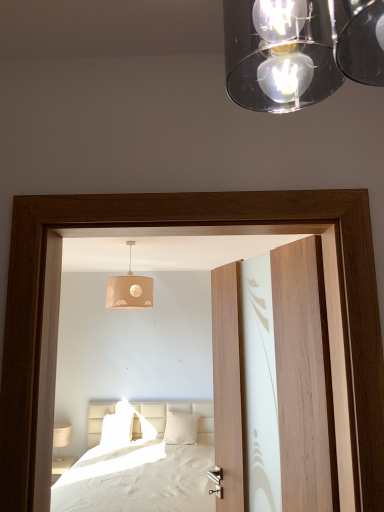
Question: Is beige fabric lampshade at center at the left side of wooden door at center?

Choices:
 (A) no
 (B) yes

Answer: (B)

Question: Is beige fabric lampshade at center located outside wooden door at center?

Choices:
 (A) no
 (B) yes

Answer: (B)

Question: Does beige fabric lampshade at center appear on the right side of wooden door at center?

Choices:
 (A) yes
 (B) no

Answer: (B)

Question: Is beige fabric lampshade at center aimed at wooden door at center?

Choices:
 (A) yes
 (B) no

Answer: (B)

Question: From a real-world perspective, is beige fabric lampshade at center located higher than wooden door at center?

Choices:
 (A) yes
 (B) no

Answer: (A)

Question: Does beige fabric lampshade at center lie behind wooden door at center?

Choices:
 (A) yes
 (B) no

Answer: (A)

Question: Does white fabric table lamp at lower left turn towards wooden door at center?

Choices:
 (A) yes
 (B) no

Answer: (B)

Question: Can you confirm if white fabric table lamp at lower left is wider than wooden door at center?

Choices:
 (A) yes
 (B) no

Answer: (A)

Question: From the image's perspective, is white fabric table lamp at lower left beneath wooden door at center?

Choices:
 (A) no
 (B) yes

Answer: (B)

Question: Can you confirm if white fabric table lamp at lower left is bigger than wooden door at center?

Choices:
 (A) no
 (B) yes

Answer: (A)

Question: Does white fabric table lamp at lower left appear on the left side of wooden door at center?

Choices:
 (A) no
 (B) yes

Answer: (B)

Question: Are white fabric table lamp at lower left and wooden door at center located far from each other?

Choices:
 (A) no
 (B) yes

Answer: (B)

Question: Is white textured pillow at center, positioned as the first pillow in right-to-left order, bigger than wooden door at center?

Choices:
 (A) yes
 (B) no

Answer: (B)